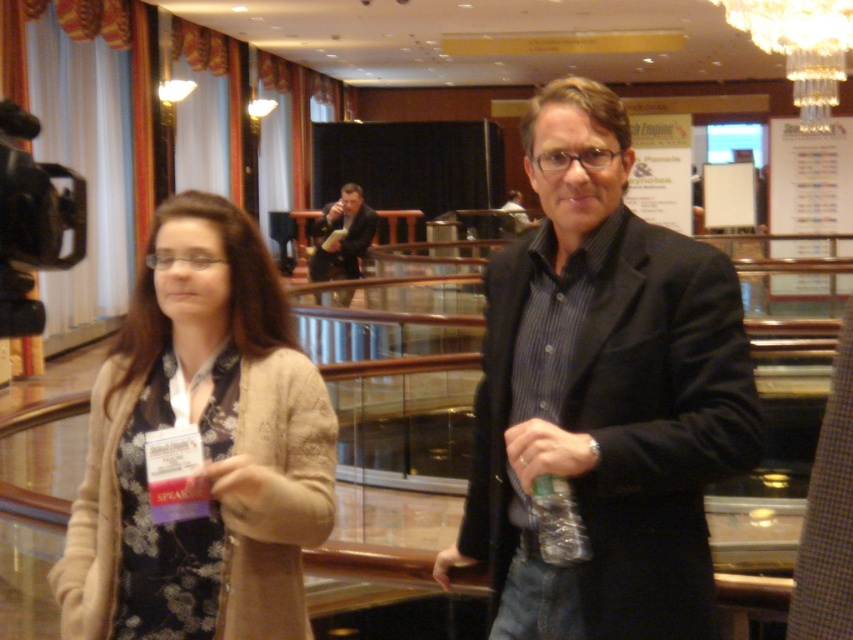
You are attending a formal event and notice two people wearing suits at the center of the scene. Which one is wearing the dark suit at center positioned to the left of the matte black suit at center?

The dark suit at center is positioned on the left side of matte black suit at center.

You are an event organizer who needs to place a 30 feet long banner between the matte black jacket at center and dark suit at center. Is there enough space between them to fit the banner?

The distance between the matte black jacket at center and dark suit at center is 28.46 feet, which is shorter than the 30 feet banner. Therefore, the banner cannot be placed between them.

Looking at this image, you are standing at the entrance of the conference hall and see two points marked in the image. Which point, point (247, 403) or point (346, 253), is closer to you?

Point (247, 403) is in front of point (346, 253), so it is closer to you.